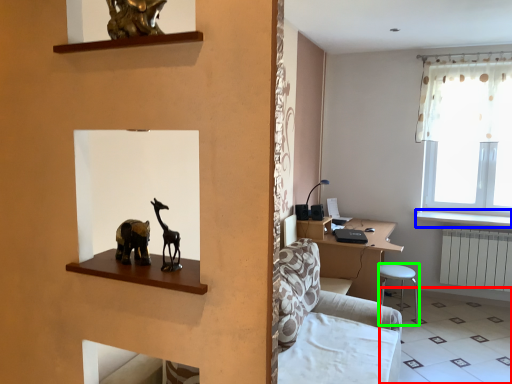
Question: Considering the real-world distances, which object is closest to tile (highlighted by a red box)? window sill (highlighted by a blue box) or bar stool (highlighted by a green box).

Choices:
 (A) window sill
 (B) bar stool

Answer: (B)